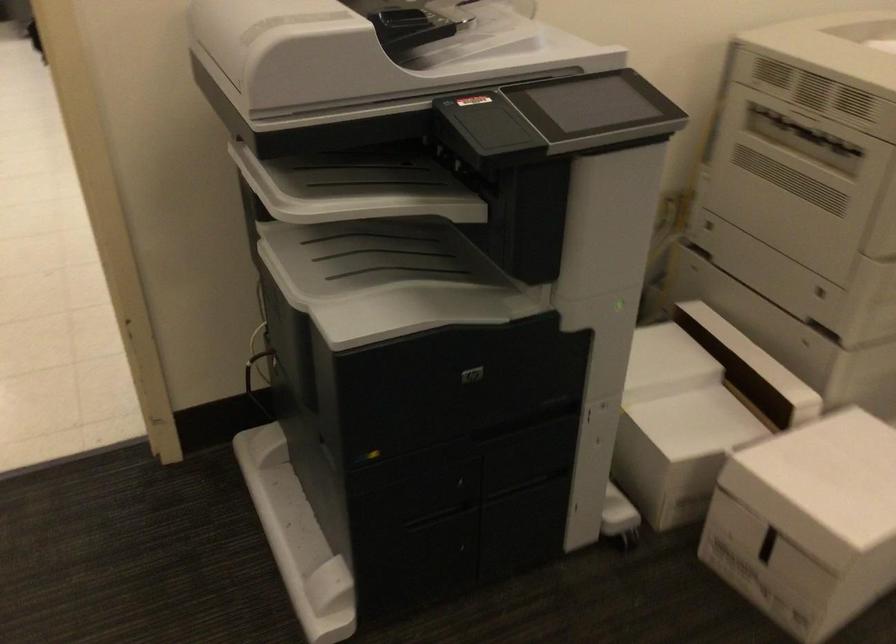
Identify the location of white box lid. This screenshot has height=644, width=896. (822, 484).